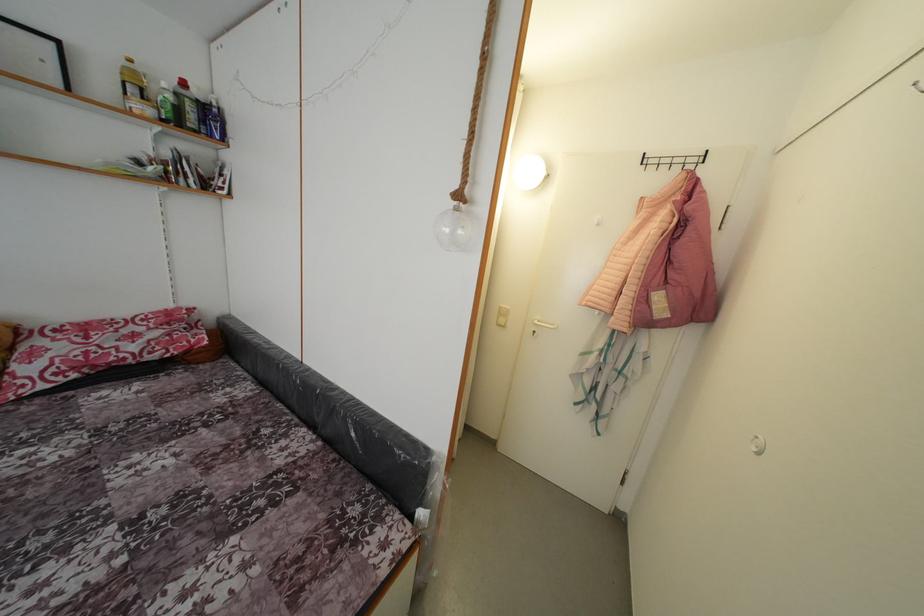
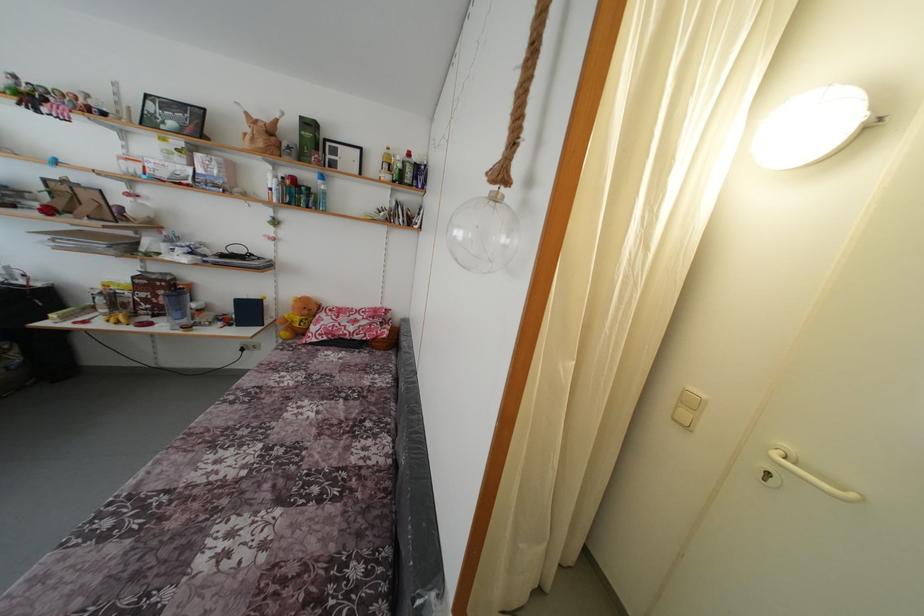
In the second image, find the point that corresponds to (506,312) in the first image.

(696, 394)